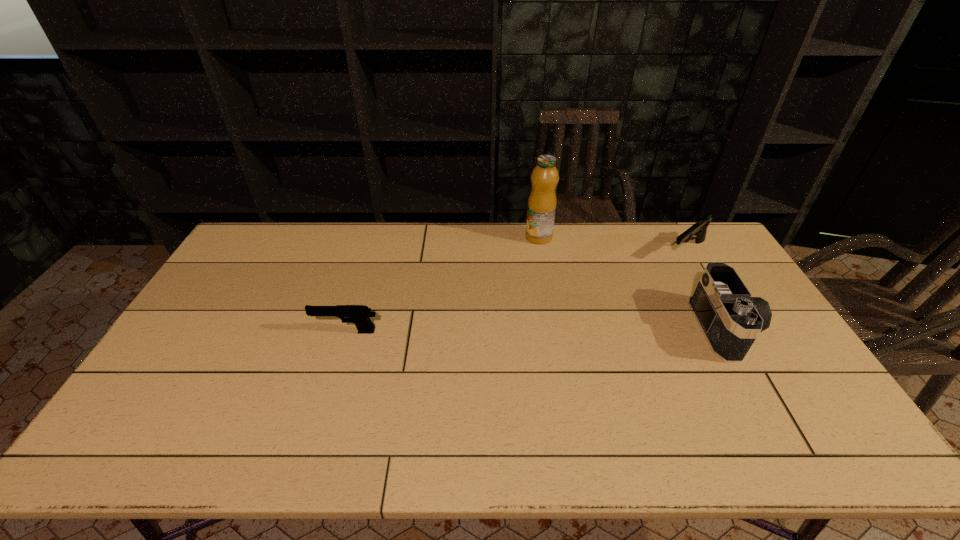
The width and height of the screenshot is (960, 540). Identify the location of empty space between the camera and the leftmost object. (537, 330).

Identify the location of empty location between the pistol and the tallest object. The image size is (960, 540). (443, 284).

This screenshot has width=960, height=540. In order to click on object that can be found as the third closest to the leftmost object in this screenshot , I will do `click(699, 229)`.

Locate an element on the screen. Image resolution: width=960 pixels, height=540 pixels. the third closest object relative to the third shortest object is located at coordinates (358, 314).

The width and height of the screenshot is (960, 540). What are the coordinates of `vacant space that satisfies the following two spatial constraints: 1. on the front side of the fruit juice; 2. on the left side of the gun` in the screenshot? It's located at (541, 251).

At what (x,y) coordinates should I click in order to perform the action: click on free location that satisfies the following two spatial constraints: 1. on the front side of the camera; 2. on the front-facing side of the fruit juice. Please return your answer as a coordinate pair (x, y). Looking at the image, I should click on (554, 328).

At what (x,y) coordinates should I click in order to perform the action: click on vacant region that satisfies the following two spatial constraints: 1. on the front side of the third shortest object; 2. on the front-facing side of the third object from right to left. Please return your answer as a coordinate pair (x, y). This screenshot has width=960, height=540. Looking at the image, I should click on (554, 328).